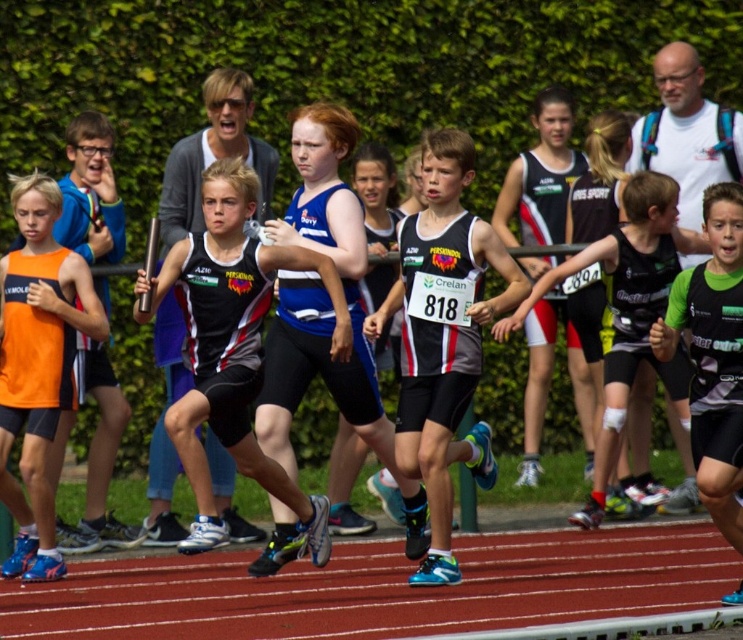
Question: Which point appears closest to the camera in this image?

Choices:
 (A) (481, 321)
 (B) (707, 307)
 (C) (48, 515)
 (D) (603, 493)

Answer: (B)

Question: Is black matte tank top at center wider than green matte tank top at center?

Choices:
 (A) no
 (B) yes

Answer: (B)

Question: From the image, what is the correct spatial relationship of orange matte tank top at left in relation to black matte tank top at center?

Choices:
 (A) above
 (B) below

Answer: (A)

Question: Can you confirm if matte black running suit at center is smaller than green matte tank top at center?

Choices:
 (A) yes
 (B) no

Answer: (B)

Question: Which point is closer to the camera?

Choices:
 (A) black matte tank top at center
 (B) matte gray vest at center
 (C) orange matte tank top at left
 (D) green matte tank top at center

Answer: (D)

Question: Among these points, which one is nearest to the camera?

Choices:
 (A) (669, 337)
 (B) (597, 516)
 (C) (195, 381)

Answer: (C)